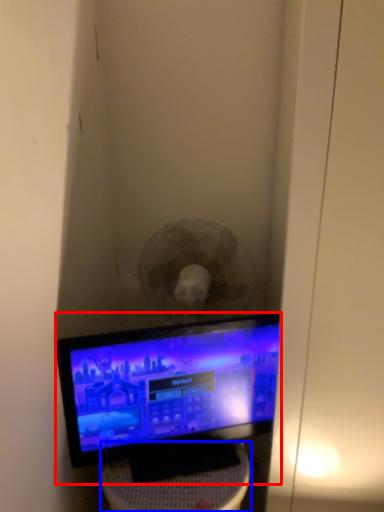
Question: Which object appears closest to the camera in this image, computer monitor (highlighted by a red box) or furniture (highlighted by a blue box)?

Choices:
 (A) computer monitor
 (B) furniture

Answer: (B)